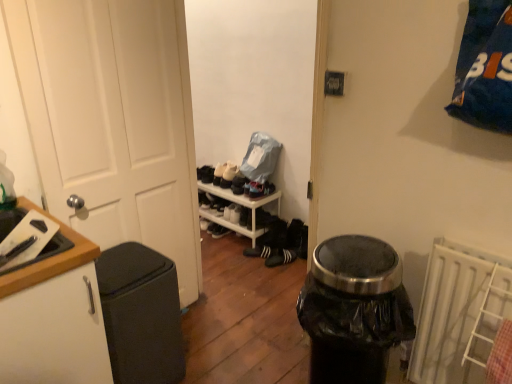
Question: Is white matte cabinet at left in front of white plastic radiator at lower right?

Choices:
 (A) yes
 (B) no

Answer: (A)

Question: From a real-world perspective, is white matte cabinet at left physically above white plastic radiator at lower right?

Choices:
 (A) yes
 (B) no

Answer: (B)

Question: Is white matte cabinet at left taller than white plastic radiator at lower right?

Choices:
 (A) yes
 (B) no

Answer: (A)

Question: Considering the relative sizes of white matte cabinet at left and white plastic radiator at lower right in the image provided, is white matte cabinet at left bigger than white plastic radiator at lower right?

Choices:
 (A) no
 (B) yes

Answer: (B)

Question: Is white matte cabinet at left turned away from white plastic radiator at lower right?

Choices:
 (A) yes
 (B) no

Answer: (B)

Question: Is black matte trash can at left in front of or behind wooden cutting board at left in the image?

Choices:
 (A) behind
 (B) front

Answer: (A)

Question: Considering the positions of black matte trash can at left and wooden cutting board at left in the image, is black matte trash can at left bigger or smaller than wooden cutting board at left?

Choices:
 (A) small
 (B) big

Answer: (B)

Question: Is black matte trash can at left to the left or to the right of wooden cutting board at left in the image?

Choices:
 (A) left
 (B) right

Answer: (B)

Question: From a real-world perspective, is black matte trash can at left above or below wooden cutting board at left?

Choices:
 (A) above
 (B) below

Answer: (B)

Question: Looking at their shapes, would you say suede black shoe at center, which is the 2th shoe in top-to-bottom order, is wider or thinner than white matte door at left?

Choices:
 (A) wide
 (B) thin

Answer: (A)

Question: Is point (230, 175) positioned closer to the camera than point (80, 46)?

Choices:
 (A) farther
 (B) closer

Answer: (A)

Question: From the image's perspective, is suede black shoe at center, which is the second shoe in bottom-to-top order, located above or below white matte door at left?

Choices:
 (A) below
 (B) above

Answer: (B)

Question: Relative to white matte door at left, is suede black shoe at center, which is the 2th shoe in top-to-bottom order, in front or behind?

Choices:
 (A) front
 (B) behind

Answer: (B)

Question: Does point (203, 173) appear closer or farther from the camera than point (248, 233)?

Choices:
 (A) closer
 (B) farther

Answer: (B)

Question: Is white suede shoe at center, the 3th shoe ordered from the bottom, bigger or smaller than white plastic shelf at center?

Choices:
 (A) small
 (B) big

Answer: (A)